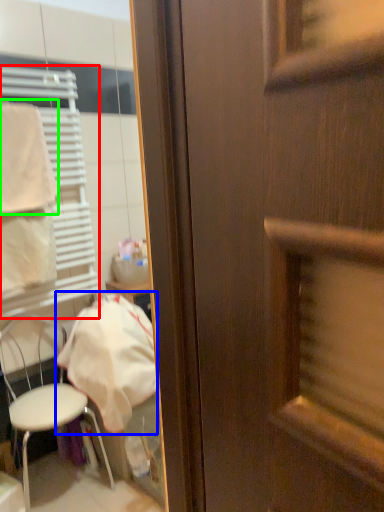
Question: Considering the real-world distances, which object is farthest from shutter (highlighted by a red box)? cloth (highlighted by a blue box) or towel/napkin (highlighted by a green box)?

Choices:
 (A) cloth
 (B) towel/napkin

Answer: (A)